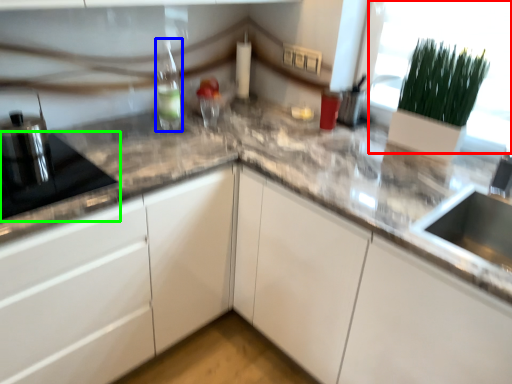
Question: Which is farther away from glass door (highlighted by a red box)? bottle (highlighted by a blue box) or appliance (highlighted by a green box)?

Choices:
 (A) bottle
 (B) appliance

Answer: (B)